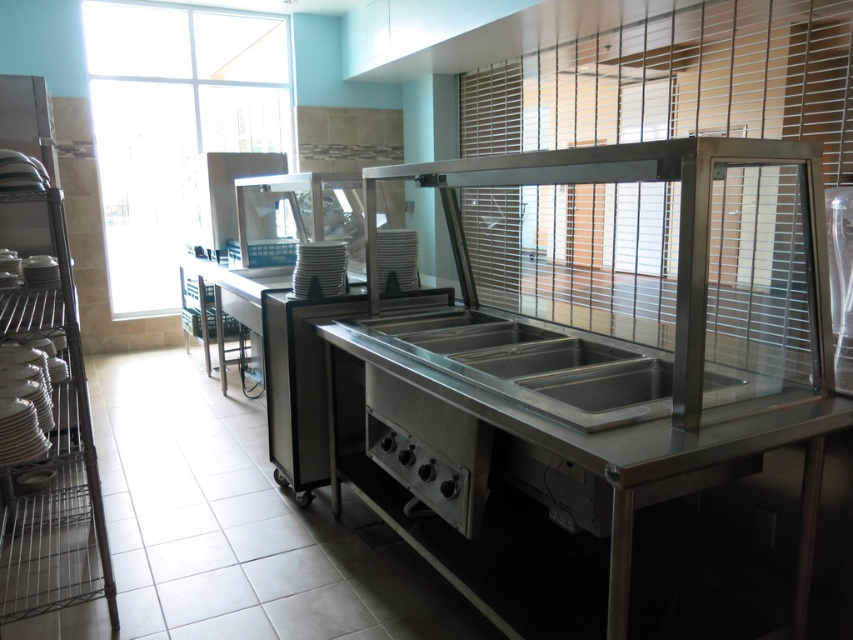
Question: Which object is closer to the camera taking this photo?

Choices:
 (A) stainless steel sink at center
 (B) stainless steel buffet at center

Answer: (B)

Question: Which point is farther to the camera?

Choices:
 (A) pos(473,330)
 (B) pos(772,614)

Answer: (A)

Question: Is stainless steel buffet at center positioned at the back of stainless steel sink at center?

Choices:
 (A) no
 (B) yes

Answer: (A)

Question: Where is stainless steel buffet at center located in relation to stainless steel sink at center in the image?

Choices:
 (A) above
 (B) below

Answer: (B)

Question: Does stainless steel buffet at center appear on the right side of stainless steel sink at center?

Choices:
 (A) no
 (B) yes

Answer: (B)